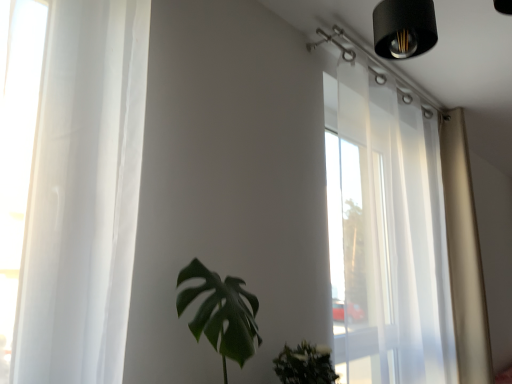
The width and height of the screenshot is (512, 384). Find the location of `green matte leafy plant at center`. green matte leafy plant at center is located at coordinates (221, 313).

Does point (475, 219) lie in front of point (208, 310)?

No, it is behind (208, 310).

Could you tell me if beige fabric curtain at right is facing green matte leafy plant at center?

No, beige fabric curtain at right is not turned towards green matte leafy plant at center.

Considering the positions of objects beige fabric curtain at right and green matte leafy plant at center in the image provided, who is more to the left, beige fabric curtain at right or green matte leafy plant at center?

green matte leafy plant at center is more to the left.

Locate an element on the screen. The height and width of the screenshot is (384, 512). houseplant located on the left of beige fabric curtain at right is located at coordinates (221, 313).

Does point (345, 76) appear closer or farther from the camera than point (216, 304)?

Point (345, 76) is farther from the camera than point (216, 304).

Who is bigger, transparent curtain at upper right or green matte leafy plant at center?

transparent curtain at upper right.

Is transparent curtain at upper right inside the boundaries of green matte leafy plant at center, or outside?

transparent curtain at upper right is spatially situated outside green matte leafy plant at center.

Which of these two, transparent curtain at upper right or green matte leafy plant at center, stands shorter?

green matte leafy plant at center is shorter.

Is green matte leafy plant at center positioned before transparent curtain at upper right?

Yes, it is in front of transparent curtain at upper right.

From the picture: Can you confirm if green matte leafy plant at center is shorter than transparent curtain at upper right?

Indeed, green matte leafy plant at center has a lesser height compared to transparent curtain at upper right.

In the image, is green matte leafy plant at center on the left side or the right side of transparent curtain at upper right?

green matte leafy plant at center is positioned on transparent curtain at upper right's left side.

Is point (178, 297) closer to viewer compared to point (375, 324)?

Yes.

From the image's perspective, is beige fabric curtain at right positioned above or below transparent curtain at upper right?

beige fabric curtain at right is below transparent curtain at upper right.

Between beige fabric curtain at right and transparent curtain at upper right, which one appears on the left side from the viewer's perspective?

transparent curtain at upper right is more to the left.

From a real-world perspective, is beige fabric curtain at right above or below transparent curtain at upper right?

beige fabric curtain at right is situated lower than transparent curtain at upper right in the real world.

Can you tell me how much green matte leafy plant at center and beige fabric curtain at right differ in facing direction?

The angle between the facing direction of green matte leafy plant at center and the facing direction of beige fabric curtain at right is 5.23e-05 degrees.

Can you see green matte leafy plant at center touching beige fabric curtain at right?

No, green matte leafy plant at center is not with beige fabric curtain at right.

Which is in front, point (238, 352) or point (454, 278)?

The point (238, 352) is closer to the camera.

Is green matte leafy plant at center outside of beige fabric curtain at right?

Indeed, green matte leafy plant at center is completely outside beige fabric curtain at right.

Measure the distance from transparent curtain at upper right to beige fabric curtain at right.

19.30 inches.

Which object is further away from the camera, transparent curtain at upper right or beige fabric curtain at right?

beige fabric curtain at right.

Is transparent curtain at upper right next to beige fabric curtain at right and touching it?

There is a gap between transparent curtain at upper right and beige fabric curtain at right.

In the scene shown: Can you confirm if transparent curtain at upper right is bigger than beige fabric curtain at right?

Correct, transparent curtain at upper right is larger in size than beige fabric curtain at right.

Where is `curtain above the green matte leafy plant at center (from the image's perspective)`? curtain above the green matte leafy plant at center (from the image's perspective) is located at coordinates (464, 253).

Where is `houseplant lying below the transparent curtain at upper right (from the image's perspective)`? The width and height of the screenshot is (512, 384). houseplant lying below the transparent curtain at upper right (from the image's perspective) is located at coordinates (221, 313).

Which object lies nearer to the anchor point green matte leafy plant at center, beige fabric curtain at right or transparent curtain at upper right?

Among the two, transparent curtain at upper right is located nearer to green matte leafy plant at center.

Considering their positions, is beige fabric curtain at right positioned further to transparent curtain at upper right than green matte leafy plant at center?

Based on the image, green matte leafy plant at center appears to be further to transparent curtain at upper right.

From the image, which object appears to be nearer to transparent curtain at upper right, green matte leafy plant at center or beige fabric curtain at right?

Based on the image, beige fabric curtain at right appears to be nearer to transparent curtain at upper right.

Looking at the image, which one is located further to beige fabric curtain at right, green matte leafy plant at center or transparent curtain at upper right?

green matte leafy plant at center.

Looking at the image, which one is located closer to green matte leafy plant at center, transparent curtain at upper right or beige fabric curtain at right?

transparent curtain at upper right is positioned closer to the anchor green matte leafy plant at center.

Based on their spatial positions, is transparent curtain at upper right or green matte leafy plant at center closer to beige fabric curtain at right?

transparent curtain at upper right.

Where is `window between green matte leafy plant at center and beige fabric curtain at right along the z-axis`? window between green matte leafy plant at center and beige fabric curtain at right along the z-axis is located at coordinates (386, 235).